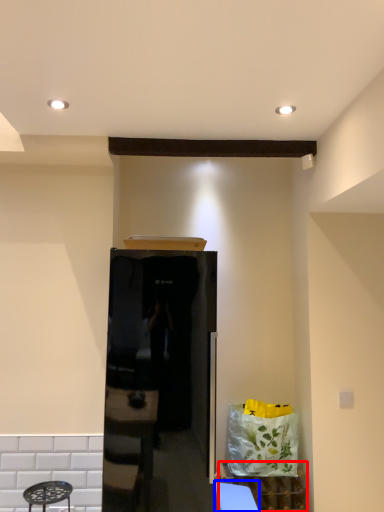
Question: Which object appears farthest to the camera in this image, cabinetry (highlighted by a red box) or table (highlighted by a blue box)?

Choices:
 (A) cabinetry
 (B) table

Answer: (A)